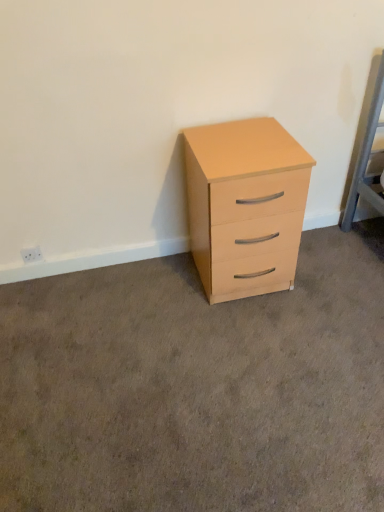
I want to click on light wood drawer at center, so click(197, 387).

The height and width of the screenshot is (512, 384). What do you see at coordinates (197, 387) in the screenshot?
I see `light wood drawer at center` at bounding box center [197, 387].

In order to face light wood/finish chest of drawers at center, should I rotate leftwards or rightwards?

You should rotate right by 6.734 degrees.

At what (x,y) coordinates should I click in order to perform the action: click on light wood/finish chest of drawers at center. Please return your answer as a coordinate pair (x, y). This screenshot has width=384, height=512. Looking at the image, I should click on (245, 206).

What do you see at coordinates (245, 206) in the screenshot? This screenshot has height=512, width=384. I see `light wood/finish chest of drawers at center` at bounding box center [245, 206].

Where is `light wood drawer at center`? The image size is (384, 512). light wood drawer at center is located at coordinates click(x=197, y=387).

Is light wood drawer at center to the left or to the right of light wood/finish chest of drawers at center in the image?

light wood drawer at center is to the right of light wood/finish chest of drawers at center.

Who is more distant, light wood drawer at center or light wood/finish chest of drawers at center?

light wood/finish chest of drawers at center is behind.

Which point is more distant from viewer, (364, 254) or (216, 195)?

Positioned behind is point (364, 254).

From the image's perspective, which one is positioned lower, light wood drawer at center or light wood/finish chest of drawers at center?

light wood drawer at center.

From a real-world perspective, is light wood drawer at center beneath light wood/finish chest of drawers at center?

Indeed, from a real-world perspective, light wood drawer at center is positioned beneath light wood/finish chest of drawers at center.

Considering the relative sizes of light wood drawer at center and light wood/finish chest of drawers at center in the image provided, is light wood drawer at center thinner than light wood/finish chest of drawers at center?

No.

Considering the relative sizes of light wood drawer at center and light wood/finish chest of drawers at center in the image provided, is light wood drawer at center shorter than light wood/finish chest of drawers at center?

Indeed, light wood drawer at center has a lesser height compared to light wood/finish chest of drawers at center.

Who is bigger, light wood drawer at center or light wood/finish chest of drawers at center?

Bigger between the two is light wood/finish chest of drawers at center.

Is light wood/finish chest of drawers at center located within light wood drawer at center?

No, light wood/finish chest of drawers at center is not a part of light wood drawer at center.

Are light wood drawer at center and light wood/finish chest of drawers at center located far from each other?

light wood drawer at center is actually quite close to light wood/finish chest of drawers at center.

Is light wood drawer at center facing towards light wood/finish chest of drawers at center?

No, light wood drawer at center is not oriented towards light wood/finish chest of drawers at center.

How distant is light wood drawer at center from light wood/finish chest of drawers at center?

light wood drawer at center and light wood/finish chest of drawers at center are 19.25 inches apart.

The height and width of the screenshot is (512, 384). In order to click on chest of drawers behind the light wood drawer at center in this screenshot , I will do `click(245, 206)`.

Does light wood/finish chest of drawers at center appear on the right side of light wood drawer at center?

No, light wood/finish chest of drawers at center is not to the right of light wood drawer at center.

Between light wood/finish chest of drawers at center and light wood drawer at center, which one is positioned in front?

light wood drawer at center is in front.

Which is closer to the camera, (228, 272) or (59, 303)?

Point (228, 272).

From the image's perspective, which one is positioned higher, light wood/finish chest of drawers at center or light wood drawer at center?

light wood/finish chest of drawers at center.

From a real-world perspective, is light wood/finish chest of drawers at center physically located above or below light wood drawer at center?

From a real-world perspective, light wood/finish chest of drawers at center is physically above light wood drawer at center.

Does light wood/finish chest of drawers at center have a greater width compared to light wood drawer at center?

In fact, light wood/finish chest of drawers at center might be narrower than light wood drawer at center.

Between light wood/finish chest of drawers at center and light wood drawer at center, which one has more height?

light wood/finish chest of drawers at center.

Which of these two, light wood/finish chest of drawers at center or light wood drawer at center, is smaller?

Smaller between the two is light wood drawer at center.

Could light wood drawer at center be considered to be inside light wood/finish chest of drawers at center?

No, light wood drawer at center is not a part of light wood/finish chest of drawers at center.

Is light wood/finish chest of drawers at center next to light wood drawer at center and touching it?

No, light wood/finish chest of drawers at center is not in contact with light wood drawer at center.

Is light wood/finish chest of drawers at center looking in the opposite direction of light wood drawer at center?

No, light wood drawer at center is not at the back of light wood/finish chest of drawers at center.

Where is `concrete below the light wood/finish chest of drawers at center (from the image's perspective)`? The height and width of the screenshot is (512, 384). concrete below the light wood/finish chest of drawers at center (from the image's perspective) is located at coordinates (197, 387).

This screenshot has width=384, height=512. Find the location of `concrete on the right of light wood/finish chest of drawers at center`. concrete on the right of light wood/finish chest of drawers at center is located at coordinates (197, 387).

Locate an element on the screen. the chest of drawers positioned vertically above the light wood drawer at center (from a real-world perspective) is located at coordinates (245, 206).